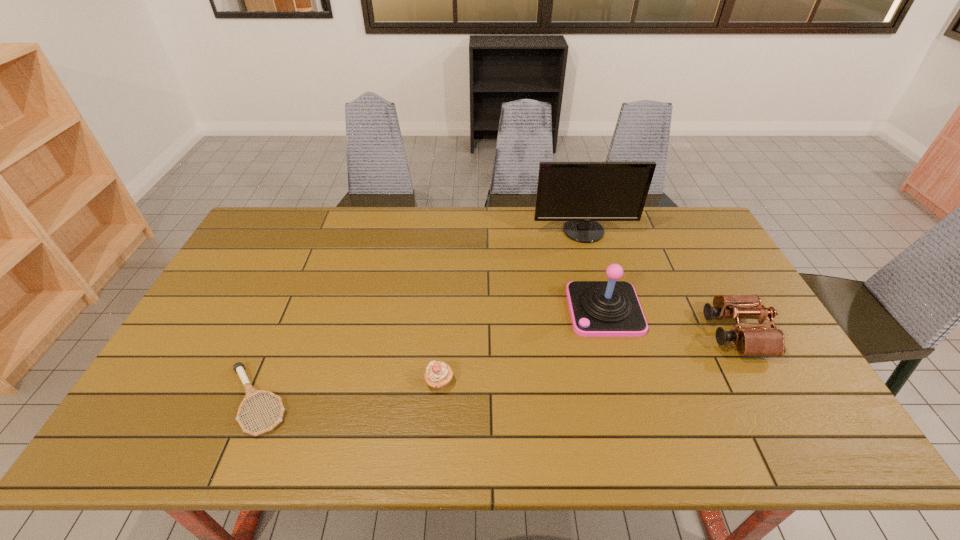
Where is `vacant point that satisfies the following two spatial constraints: 1. through the eyepieces of the binoculars; 2. on the front side of the fourth tallest object`? vacant point that satisfies the following two spatial constraints: 1. through the eyepieces of the binoculars; 2. on the front side of the fourth tallest object is located at coordinates (762, 382).

Identify the location of free spot that satisfies the following two spatial constraints: 1. through the eyepieces of the rightmost object; 2. on the front side of the second object from left to right. (762, 382).